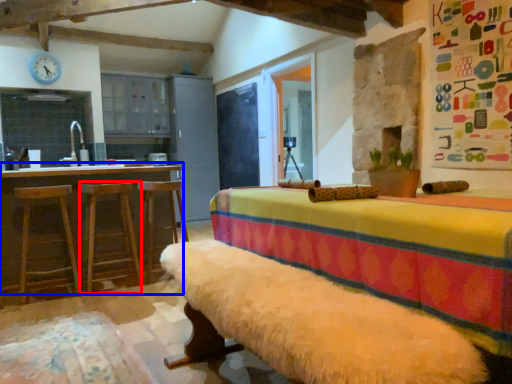
Question: Among these objects, which one is nearest to the camera, bar stool (highlighted by a red box) or table (highlighted by a blue box)?

Choices:
 (A) bar stool
 (B) table

Answer: (B)